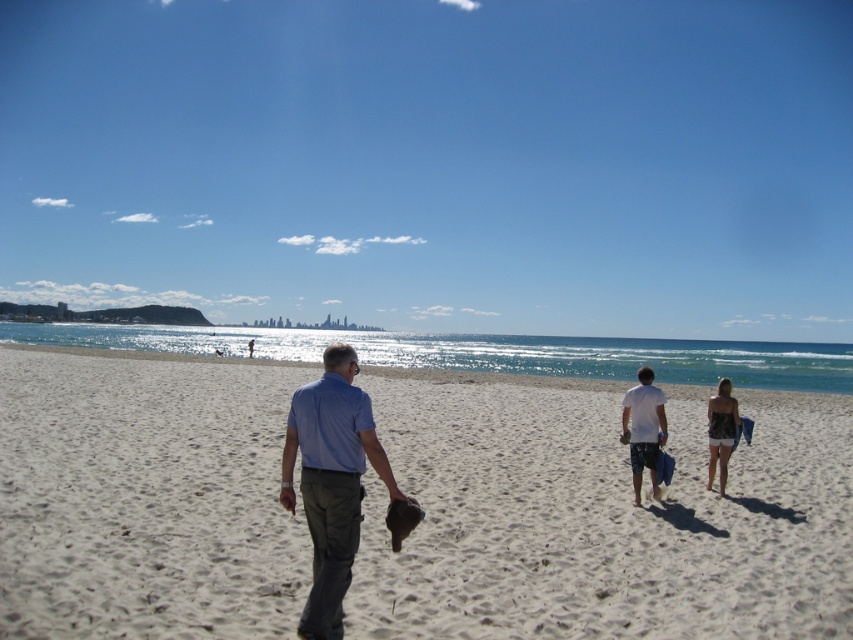
You are standing at the point labeled as point (321, 611) and want to take a photo of the city skyline in the distance. If your camera has a maximum zoom range of 5 meters, will you be able to capture the city skyline clearly?

The point labeled as point (321, 611) is 4.56 meters away from the camera. Since the camera has a maximum zoom range of 5 meters, you can capture the city skyline clearly as the distance is within the zoom range.